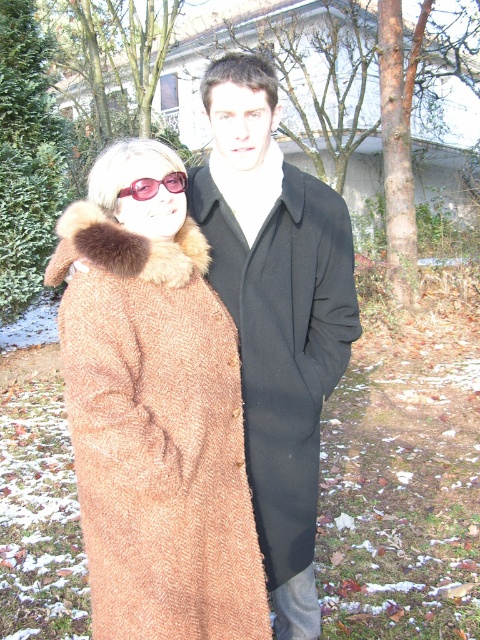
Question: Which object is farther from the camera taking this photo?

Choices:
 (A) black wool coat at center
 (B) translucent pink goggles at upper left
 (C) brown wool coat at center

Answer: (A)

Question: Which of the following is the farthest from the observer?

Choices:
 (A) (176, 192)
 (B) (346, 211)

Answer: (B)

Question: Which object appears closest to the camera in this image?

Choices:
 (A) black wool coat at center
 (B) brown wool coat at center
 (C) translucent pink goggles at upper left

Answer: (C)

Question: Does black wool coat at center lie in front of translucent pink goggles at upper left?

Choices:
 (A) yes
 (B) no

Answer: (B)

Question: From the image, what is the correct spatial relationship of black wool coat at center in relation to translucent pink goggles at upper left?

Choices:
 (A) left
 (B) right

Answer: (B)

Question: Does brown wool coat at center appear over translucent pink goggles at upper left?

Choices:
 (A) no
 (B) yes

Answer: (A)